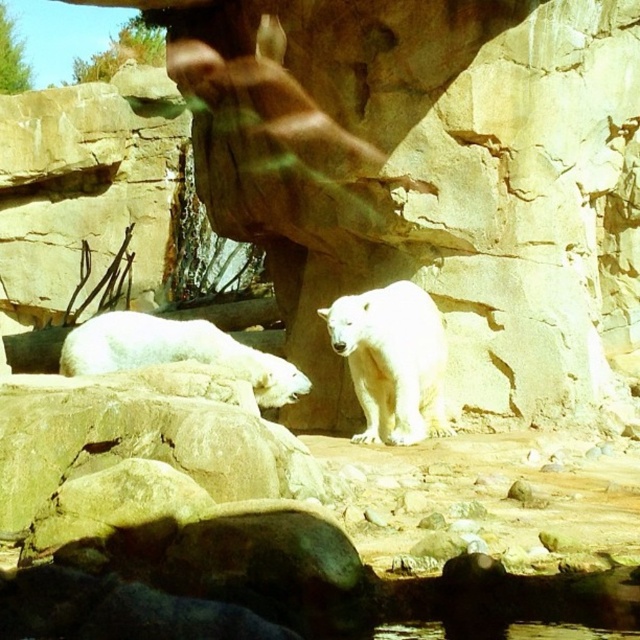
Does white fur bear at center have a greater width compared to white fur bear at lower left?

No.

Can you confirm if white fur bear at center is positioned to the right of white fur bear at lower left?

Indeed, white fur bear at center is positioned on the right side of white fur bear at lower left.

Who is more distant from viewer, (333, 304) or (284, 378)?

Positioned behind is point (333, 304).

Identify the location of white fur bear at center. (392, 360).